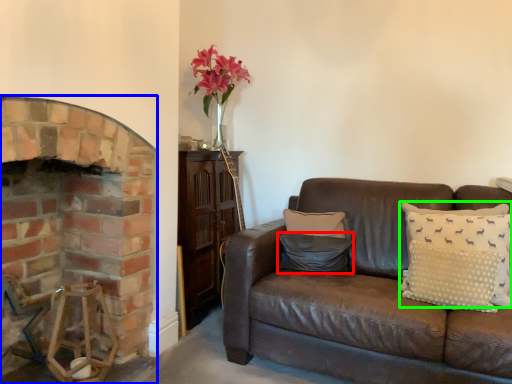
Question: Estimate the real-world distances between objects in this image. Which object is farther from pillow (highlighted by a red box), fireplace (highlighted by a blue box) or pillow (highlighted by a green box)?

Choices:
 (A) fireplace
 (B) pillow

Answer: (A)